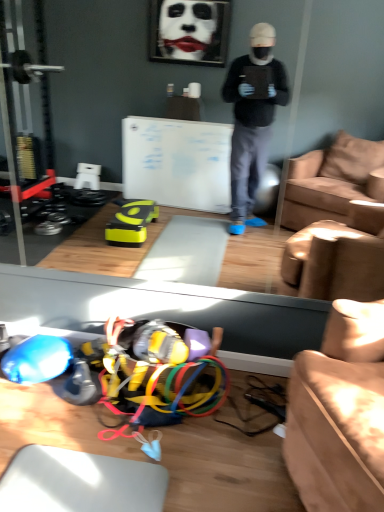
This screenshot has height=512, width=384. Describe the element at coordinates (340, 413) in the screenshot. I see `brown leather chair at lower right` at that location.

I want to click on brown leather chair at lower right, so click(x=340, y=413).

At what (x,y) coordinates should I click in order to perform the action: click on brown leather chair at lower right. Please return your answer as a coordinate pair (x, y). Looking at the image, I should click on (340, 413).